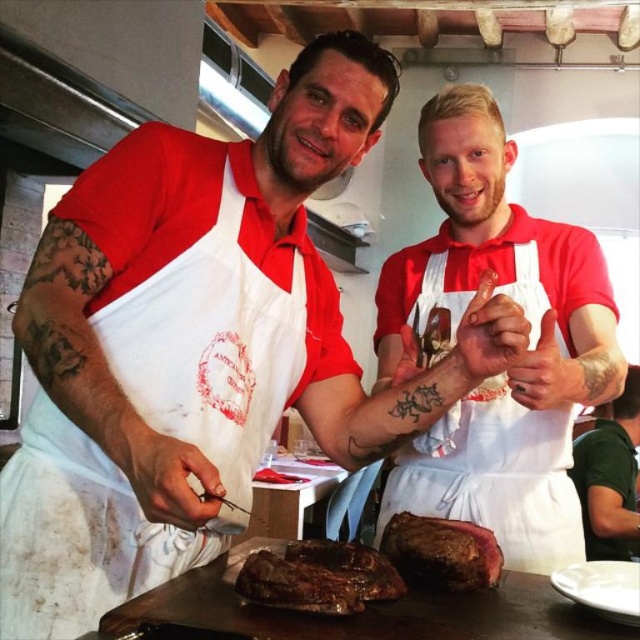
What are the coordinates of `white cotton apron at center` in the screenshot? It's located at (211, 346).

Is point (300, 296) positioned behind point (611, 465)?

No.

Find the location of a particular element. white cotton apron at center is located at coordinates (211, 346).

Who is taller, white apron at center or white cotton apron at center?

Standing taller between the two is white apron at center.

Who is more distant from viewer, (404, 288) or (17, 577)?

The point (404, 288) is behind.

Find the location of `white apron at center`. white apron at center is located at coordinates (515, 364).

Is point (212, 435) more distant than point (355, 552)?

That is True.

Between white cotton apron at center and grilled meat at center, which one has less height?

With less height is grilled meat at center.

Which is behind, point (278, 317) or point (253, 566)?

The point (278, 317) is more distant.

The image size is (640, 640). Find the location of `white cotton apron at center`. white cotton apron at center is located at coordinates (211, 346).